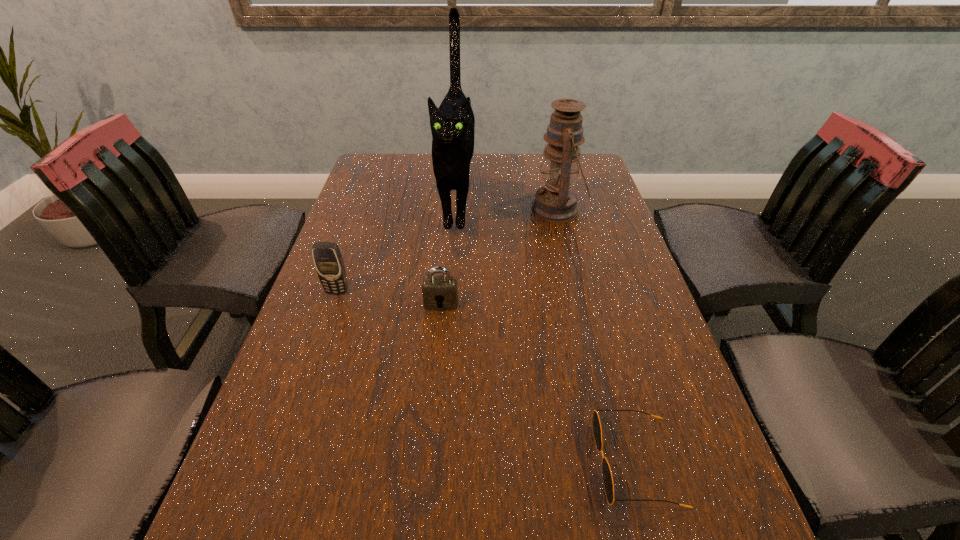
In order to click on blank region between the oil lamp and the fourth farthest object in this screenshot , I will do `click(499, 256)`.

Identify the location of vacant space that is in between the third nearest object and the fourth shortest object. This screenshot has height=540, width=960. (447, 251).

Where is `free space between the second nearest object and the second tallest object`? free space between the second nearest object and the second tallest object is located at coordinates (499, 256).

Choose which object is the second nearest neighbor to the cat. Please provide its 2D coordinates. Your answer should be formatted as a tuple, i.e. [(x, y)], where the tuple contains the x and y coordinates of a point satisfying the conditions above.

[(440, 292)]

Select which object appears as the closest to the oil lamp. Please provide its 2D coordinates. Your answer should be formatted as a tuple, i.e. [(x, y)], where the tuple contains the x and y coordinates of a point satisfying the conditions above.

[(452, 124)]

Where is `vacant region that satisfies the following two spatial constraints: 1. on the face of the fourth shortest object; 2. on the right side of the tallest object`? The width and height of the screenshot is (960, 540). vacant region that satisfies the following two spatial constraints: 1. on the face of the fourth shortest object; 2. on the right side of the tallest object is located at coordinates pos(456,210).